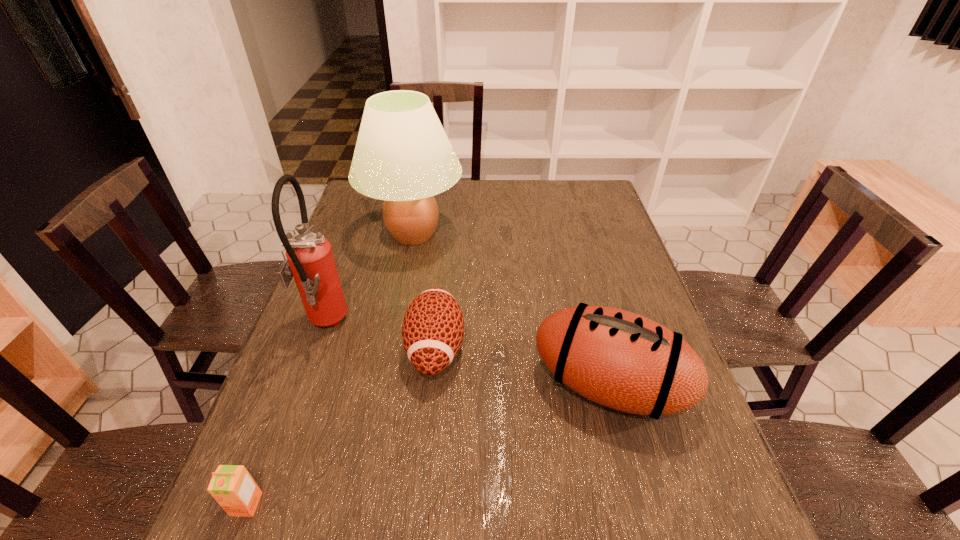
Identify the location of vacant region at the left edge of the desktop. Image resolution: width=960 pixels, height=540 pixels. (361, 282).

Find the location of `free space at the right edge of the desktop`. free space at the right edge of the desktop is located at coordinates (593, 244).

The image size is (960, 540). Find the location of `free region at the far left corner of the desktop`. free region at the far left corner of the desktop is located at coordinates (356, 196).

This screenshot has height=540, width=960. Identify the location of vacant space at the far right corner of the desktop. (595, 213).

Find the location of a particular element. empty space that is in between the fire extinguisher and the third tallest object is located at coordinates (467, 355).

The height and width of the screenshot is (540, 960). I want to click on free space between the fire extinguisher and the farthest object, so click(x=369, y=280).

This screenshot has height=540, width=960. I want to click on empty space that is in between the right football and the lampshade, so click(511, 310).

Where is `empty space between the right football and the farthest object`? The height and width of the screenshot is (540, 960). empty space between the right football and the farthest object is located at coordinates (511, 310).

This screenshot has height=540, width=960. I want to click on vacant area that lies between the right football and the shorter football, so click(522, 367).

In order to click on empty location between the taller football and the lampshade in this screenshot , I will do `click(511, 310)`.